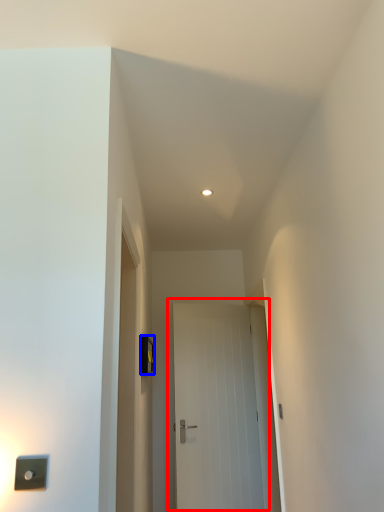
Question: Which object is further to the camera taking this photo, door (highlighted by a red box) or light switch (highlighted by a blue box)?

Choices:
 (A) door
 (B) light switch

Answer: (A)